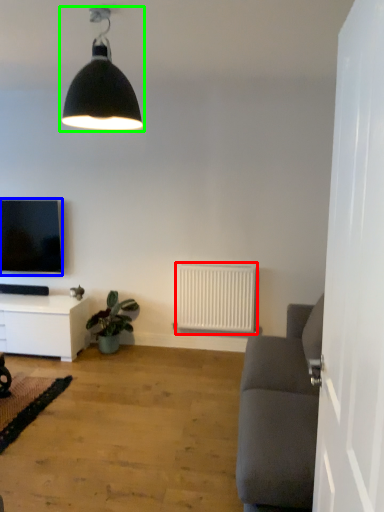
Question: Which object is positioned farthest from radiator (highlighted by a red box)? Select from television (highlighted by a blue box) and lamp (highlighted by a green box).

Choices:
 (A) television
 (B) lamp

Answer: (B)